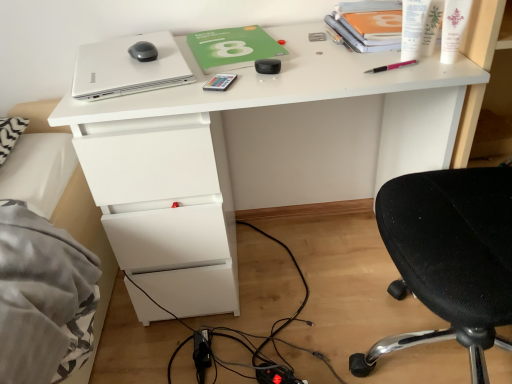
Where is `free space behind matte black mouse at upper left`? The width and height of the screenshot is (512, 384). free space behind matte black mouse at upper left is located at coordinates click(x=143, y=43).